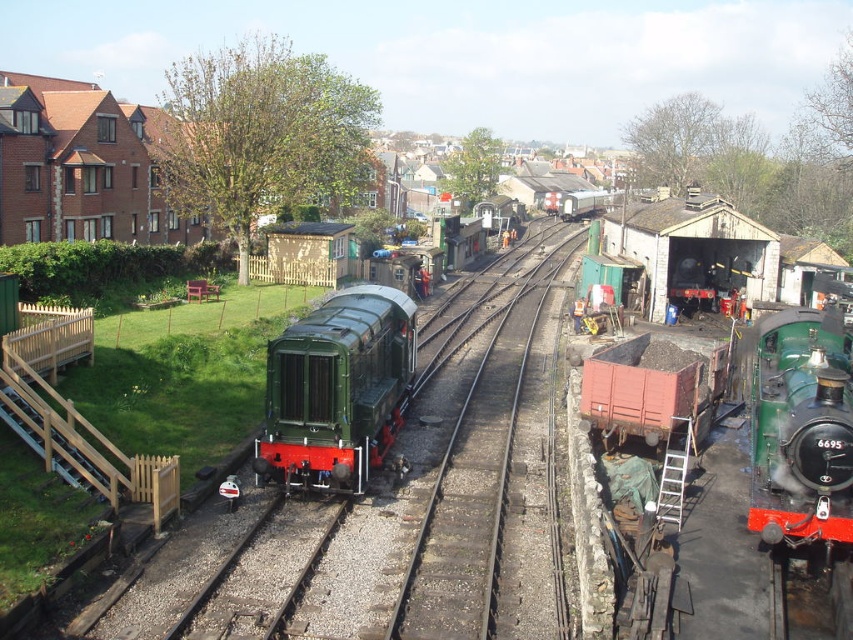
You are a visitor at the railway station and want to take a photo of both the green polished metal train at center and the green polished wood train at right. Which train should you position yourself closer to if you want both to be fully visible in your frame?

You should position yourself closer to the green polished wood train at right because the green polished metal train at center is to the left of it, so by moving closer to the right train, you can capture both in the frame more easily.